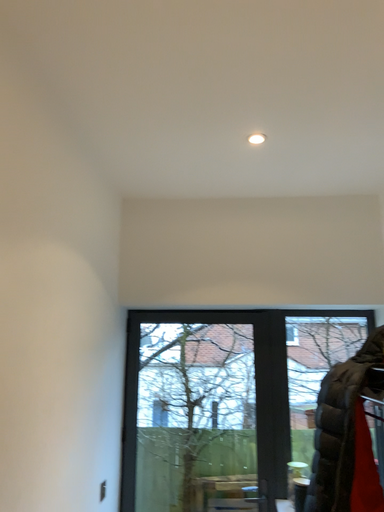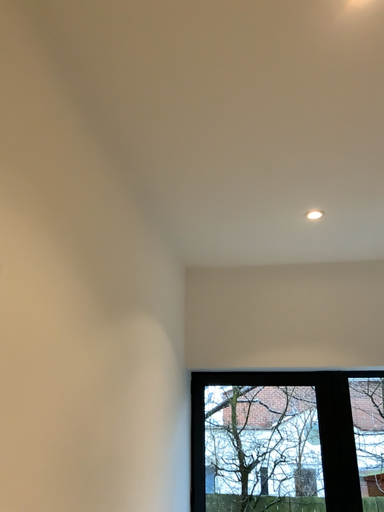
Question: Which way did the camera rotate in the video?

Choices:
 (A) rotated downward
 (B) rotated upward

Answer: (B)